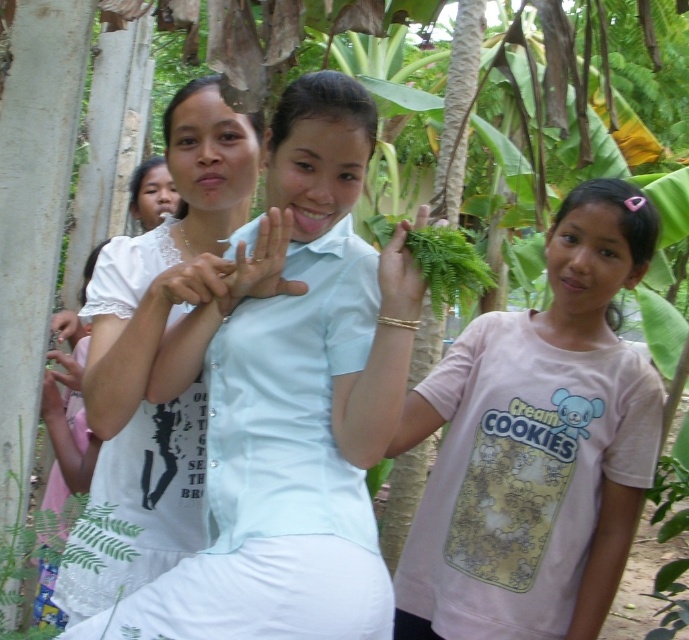
Does white matte shirt at center have a larger size compared to matte white hand at center?

Correct, white matte shirt at center is larger in size than matte white hand at center.

Measure the distance between white matte shirt at center and camera.

white matte shirt at center and camera are 4.18 feet apart from each other.

Is point (320, 388) positioned after point (289, 228)?

Yes, it is behind point (289, 228).

Locate an element on the screen. Image resolution: width=689 pixels, height=640 pixels. white matte shirt at center is located at coordinates (287, 410).

Which is behind, point (464, 497) or point (61, 412)?

The point (61, 412) is behind.

Does pink cotton shirt at right have a lesser width compared to matte white hand at lower left?

Incorrect, pink cotton shirt at right's width is not less than matte white hand at lower left's.

Where is `pink cotton shirt at right`? The image size is (689, 640). pink cotton shirt at right is located at coordinates (535, 445).

Does gold bracelet at center have a smaller size compared to white matte hand at lower left?

Yes.

Does point (382, 275) lie in front of point (70, 321)?

Yes, point (382, 275) is in front of point (70, 321).

The image size is (689, 640). What are the coordinates of `gold bracelet at center` in the screenshot? It's located at (401, 275).